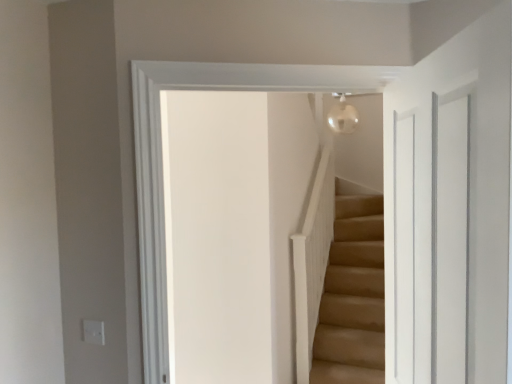
I want to click on transparent glass door at right, so click(426, 239).

What do you see at coordinates (426, 239) in the screenshot? I see `transparent glass door at right` at bounding box center [426, 239].

I want to click on white matte balustrade at upper center, so click(x=312, y=260).

The width and height of the screenshot is (512, 384). What do you see at coordinates (312, 260) in the screenshot? I see `white matte balustrade at upper center` at bounding box center [312, 260].

Measure the distance between white matte balustrade at upper center and camera.

The distance of white matte balustrade at upper center from camera is 10.07 feet.

Find the location of a particular element. transparent glass door at right is located at coordinates (426, 239).

Is white matte balustrade at upper center at the right side of transparent glass door at right?

Yes.

Is the depth of white matte balustrade at upper center greater than that of transparent glass door at right?

Yes, white matte balustrade at upper center is behind transparent glass door at right.

Which is closer to the camera, (301, 355) or (450, 302)?

Point (450, 302)

From the image's perspective, who appears lower, white matte balustrade at upper center or transparent glass door at right?

From the image's view, white matte balustrade at upper center is below.

From a real-world perspective, is white matte balustrade at upper center on transparent glass door at right?

No.

Considering the sizes of white matte balustrade at upper center and transparent glass door at right in the image, is white matte balustrade at upper center wider or thinner than transparent glass door at right?

Considering their sizes, white matte balustrade at upper center looks broader than transparent glass door at right.

Considering the sizes of white matte balustrade at upper center and transparent glass door at right in the image, is white matte balustrade at upper center taller or shorter than transparent glass door at right?

white matte balustrade at upper center is taller than transparent glass door at right.

Is white matte balustrade at upper center smaller than transparent glass door at right?

No, white matte balustrade at upper center is not smaller than transparent glass door at right.

Is white matte balustrade at upper center spatially inside transparent glass door at right, or outside of it?

The correct answer is: outside.

Is white matte balustrade at upper center in contact with transparent glass door at right?

No, white matte balustrade at upper center is not next to transparent glass door at right.

Could you tell me if white matte balustrade at upper center is facing transparent glass door at right?

No.

What's the angular difference between white matte balustrade at upper center and transparent glass door at right's facing directions?

161 degrees separate the facing orientations of white matte balustrade at upper center and transparent glass door at right.

The width and height of the screenshot is (512, 384). In the image, there is a white matte balustrade at upper center. Find the location of `glass door above it (from the image's perspective)`. glass door above it (from the image's perspective) is located at coordinates (426, 239).

Considering the relative positions of transparent glass door at right and white matte balustrade at upper center in the image provided, is transparent glass door at right to the right of white matte balustrade at upper center from the viewer's perspective?

No, transparent glass door at right is not to the right of white matte balustrade at upper center.

Does transparent glass door at right lie behind white matte balustrade at upper center?

No, transparent glass door at right is closer to the viewer.

Is point (455, 113) closer to viewer compared to point (316, 208)?

That is True.

From the image's perspective, which is below, transparent glass door at right or white matte balustrade at upper center?

white matte balustrade at upper center is shown below in the image.

From a real-world perspective, is transparent glass door at right physically located above or below white matte balustrade at upper center?

transparent glass door at right is above white matte balustrade at upper center.

Consider the image. Which of these two, transparent glass door at right or white matte balustrade at upper center, is wider?

white matte balustrade at upper center is wider.

Does transparent glass door at right have a greater height compared to white matte balustrade at upper center?

Incorrect, the height of transparent glass door at right is not larger of that of white matte balustrade at upper center.

Considering the sizes of objects transparent glass door at right and white matte balustrade at upper center in the image provided, who is smaller, transparent glass door at right or white matte balustrade at upper center?

transparent glass door at right is smaller.

Is transparent glass door at right completely or partially outside of white matte balustrade at upper center?

Yes, transparent glass door at right is outside of white matte balustrade at upper center.

Is transparent glass door at right not close to white matte balustrade at upper center?

Yes, transparent glass door at right is far from white matte balustrade at upper center.

Is transparent glass door at right facing away from white matte balustrade at upper center?

No, transparent glass door at right's orientation is not away from white matte balustrade at upper center.

In the scene shown: How many degrees apart are the facing directions of transparent glass door at right and white matte balustrade at upper center?

transparent glass door at right and white matte balustrade at upper center are facing 161 degrees away from each other.

Find the location of a particular element. glass door in front of the white matte balustrade at upper center is located at coordinates (426, 239).

What are the coordinates of `glass door above the white matte balustrade at upper center (from the image's perspective)` in the screenshot? It's located at (426, 239).

This screenshot has width=512, height=384. I want to click on glass door that is above the white matte balustrade at upper center (from a real-world perspective), so click(426, 239).